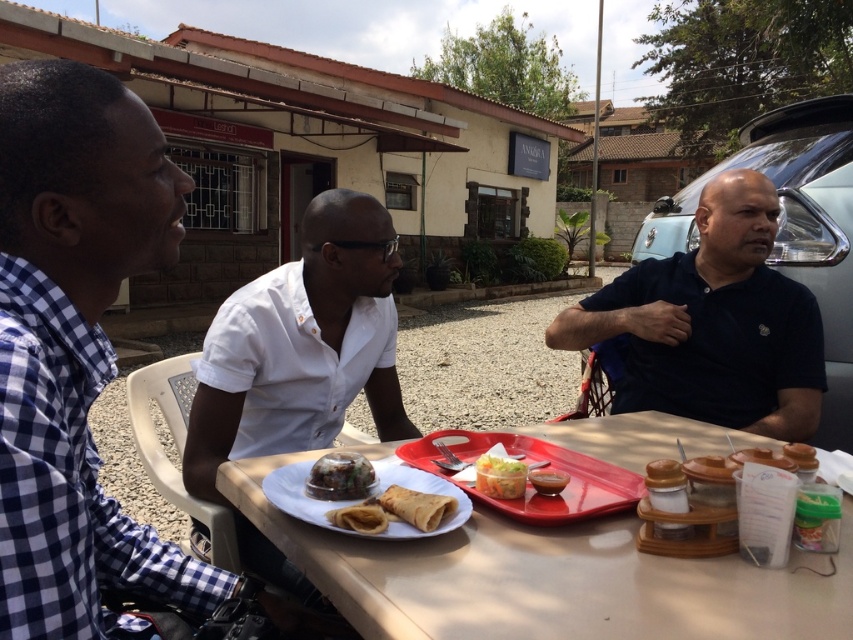
Question: Which is farther from the golden crispy pastry at center?

Choices:
 (A) checkered fabric shirt at left
 (B) smokey brown sauce at center
 (C) golden crispy crepe at center
 (D) white plastic table at center

Answer: (A)

Question: Is white matte plate at center to the left of golden crispy crepe at center from the viewer's perspective?

Choices:
 (A) no
 (B) yes

Answer: (B)

Question: Does red plastic tray at center appear under translucent plastic cup at center?

Choices:
 (A) no
 (B) yes

Answer: (B)

Question: Which point appears farthest from the camera in this image?

Choices:
 (A) (341, 525)
 (B) (357, 497)
 (C) (538, 490)
 (D) (383, 492)

Answer: (C)

Question: Among these objects, which one is nearest to the camera?

Choices:
 (A) white plastic table at center
 (B) red plastic tray at center
 (C) checkered fabric shirt at left
 (D) slightly glossy brown food at center

Answer: (C)

Question: Does checkered fabric shirt at left appear on the left side of red plastic tray at center?

Choices:
 (A) no
 (B) yes

Answer: (B)